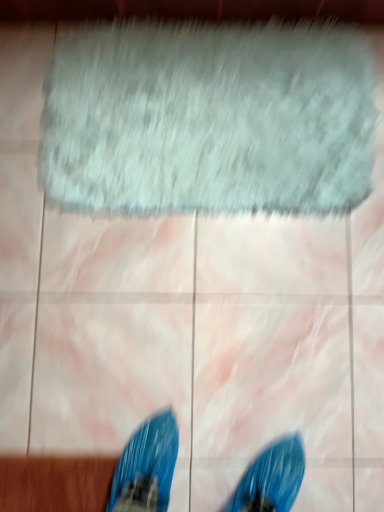
Where is `gray fuzzy bath mat at upper center`? gray fuzzy bath mat at upper center is located at coordinates (208, 119).

What do you see at coordinates (208, 119) in the screenshot?
I see `gray fuzzy bath mat at upper center` at bounding box center [208, 119].

I want to click on gray fuzzy bath mat at upper center, so point(208,119).